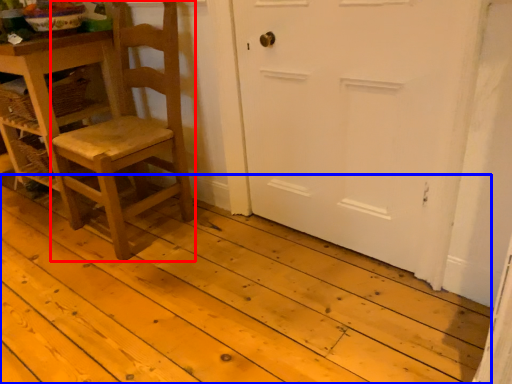
Question: Which of the following is the closest to the observer, chair (highlighted by a red box) or plank (highlighted by a blue box)?

Choices:
 (A) chair
 (B) plank

Answer: (B)